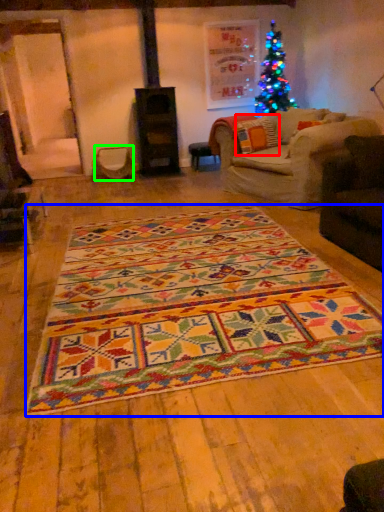
Question: Which is farther away from pillow (highlighted by a red box)? mat (highlighted by a blue box) or swivel chair (highlighted by a green box)?

Choices:
 (A) mat
 (B) swivel chair

Answer: (A)